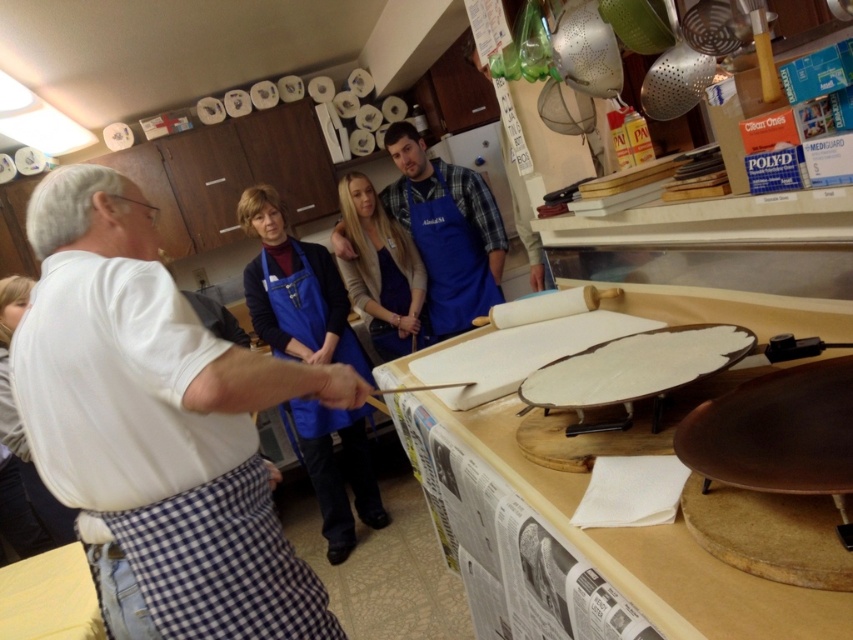
Consider the image. Who is more forward, (202,548) or (619,387)?

Point (619,387) is more forward.

Based on the photo, who is more forward, [271,401] or [648,378]?

Point [271,401] is more forward.

Where is `white checkered apron at left`? The height and width of the screenshot is (640, 853). white checkered apron at left is located at coordinates (158, 428).

Who is lower down, white checkered apron at left or blue apron at center?

white checkered apron at left is below.

What do you see at coordinates (158, 428) in the screenshot?
I see `white checkered apron at left` at bounding box center [158, 428].

From the picture: Who is more distant from viewer, (x=57, y=228) or (x=403, y=160)?

The point (x=403, y=160) is more distant.

Find the location of a particular element. white checkered apron at left is located at coordinates (158, 428).

Is blue apron at center below white matte plate at center?

No, blue apron at center is not below white matte plate at center.

Where is `blue apron at center`? The height and width of the screenshot is (640, 853). blue apron at center is located at coordinates (445, 230).